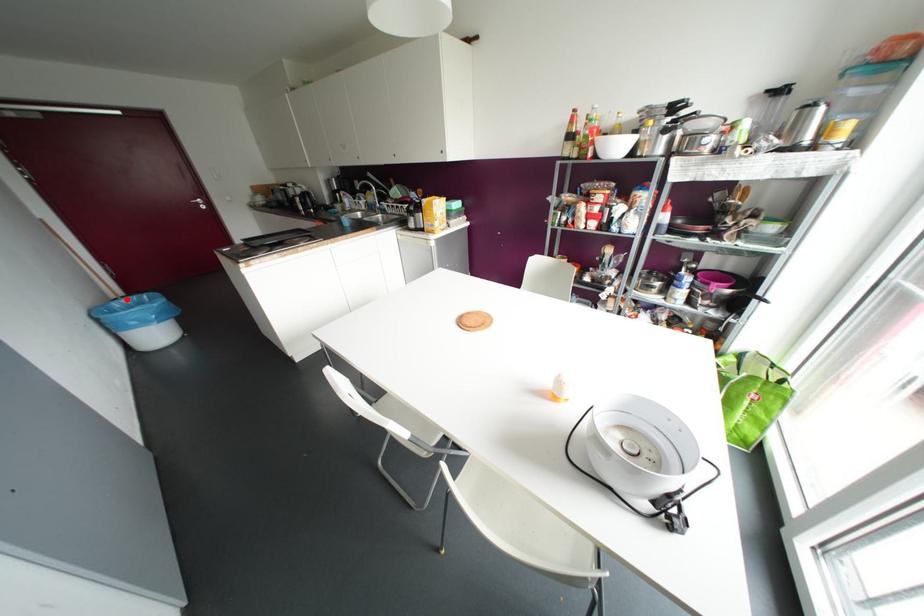
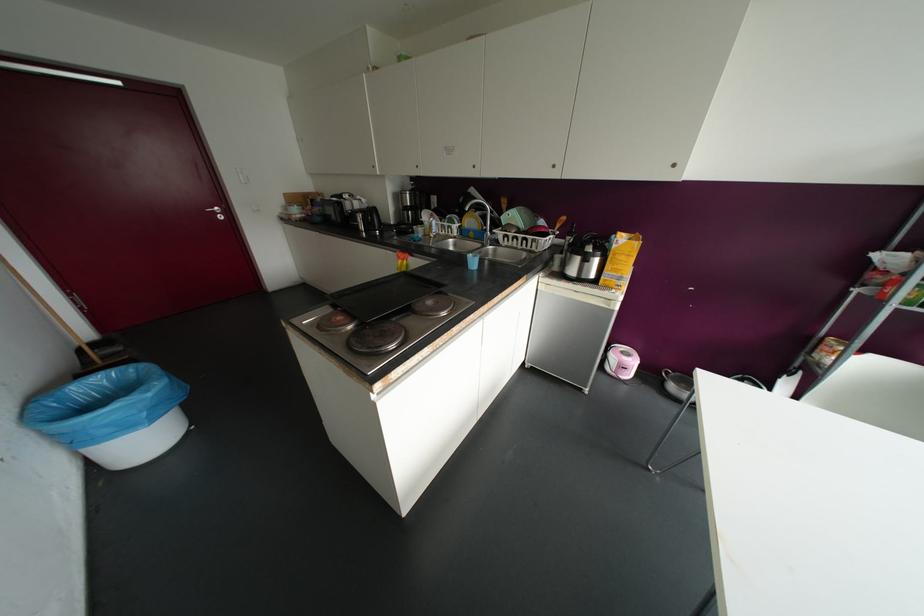
Locate, in the second image, the point that corresponds to the highlighted location in the first image.

(100, 379)